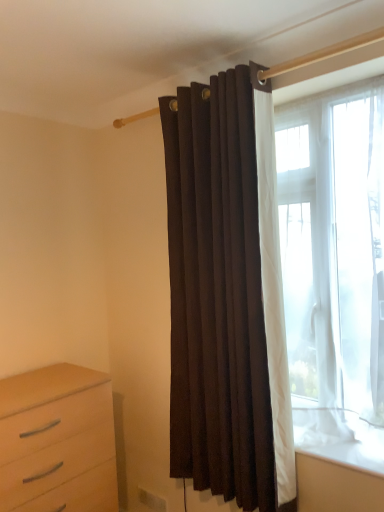
Question: From a real-world perspective, relative to transparent fabric window at right, is suede-like brown curtain at center vertically above or below?

Choices:
 (A) above
 (B) below

Answer: (B)

Question: Considering the positions of suede-like brown curtain at center and transparent fabric window at right in the image, is suede-like brown curtain at center wider or thinner than transparent fabric window at right?

Choices:
 (A) wide
 (B) thin

Answer: (B)

Question: Which object is positioned closest to the light wood chest of drawers at lower left?

Choices:
 (A) transparent fabric window at right
 (B) suede-like brown curtain at center

Answer: (B)

Question: Estimate the real-world distances between objects in this image. Which object is closer to the transparent fabric window at right?

Choices:
 (A) suede-like brown curtain at center
 (B) light wood chest of drawers at lower left

Answer: (A)